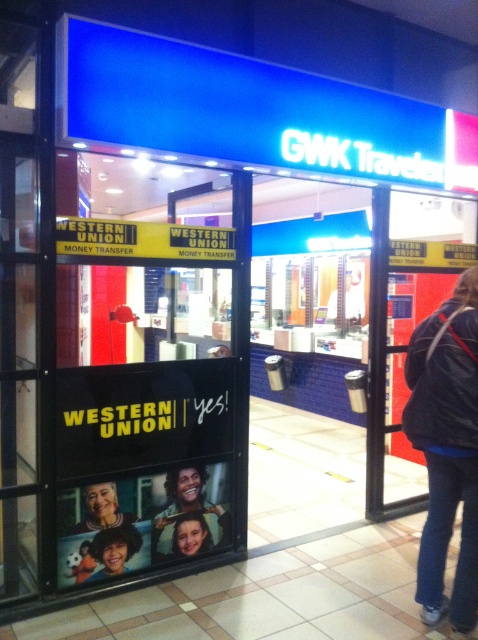
You are standing in front of the Western Union kiosk at GWK Traveler. You notice two points marked on the glass panel. The first point is at coordinate (423, 563) and the second is at (186, 244). Which of these points is closer to your viewpoint?

Point (423, 563) is closer to the camera than point (186, 244).